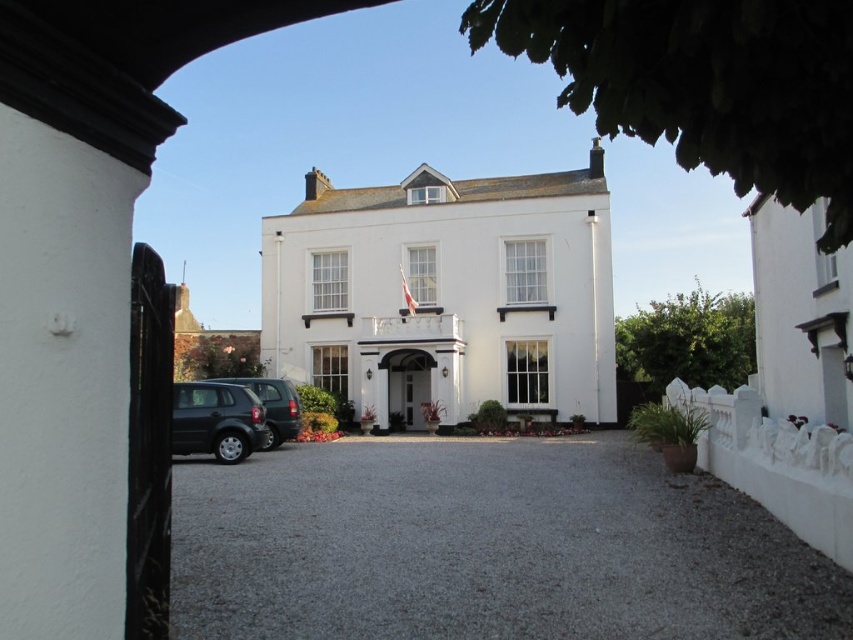
You are a delivery driver who needs to park your truck, which is 2 meters wide, in the driveway. You see the satin black car at lower left and the matte dark green suv at lower left. Can you determine if there is enough space between them to park your truck?

The satin black car at lower left is wider than the matte dark green suv at lower left. However, the exact distance between them isn

You are a delivery driver approaching the house and need to park your satin black car at lower left on the gray gravel driveway at center. Can the driveway accommodate your car?

The gray gravel driveway at center is shorter than the satin black car at lower left, so the driveway is not long enough to accommodate the car.

You are a delivery person arriving at this building with a package. Your vehicle is the satin black car at lower left. You need to park your car on the gray gravel driveway at center to unload the package. Is there enough space between your car and the driveway to safely maneuver into the driveway?

The distance between the gray gravel driveway at center and the satin black car at lower left is 5.76 meters. This distance should be sufficient for a vehicle to safely maneuver into the driveway, assuming standard vehicle turning radius requirements are met.